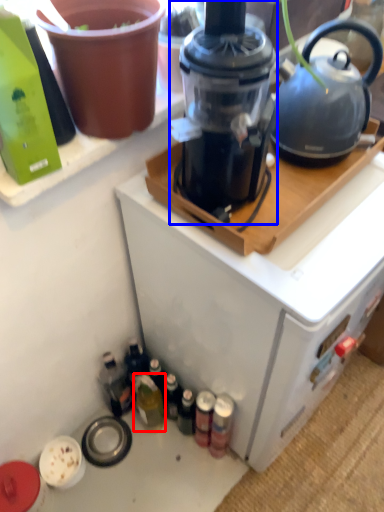
Question: Which of the following is the closest to the observer, bottle (highlighted by a red box) or blender (highlighted by a blue box)?

Choices:
 (A) bottle
 (B) blender

Answer: (B)